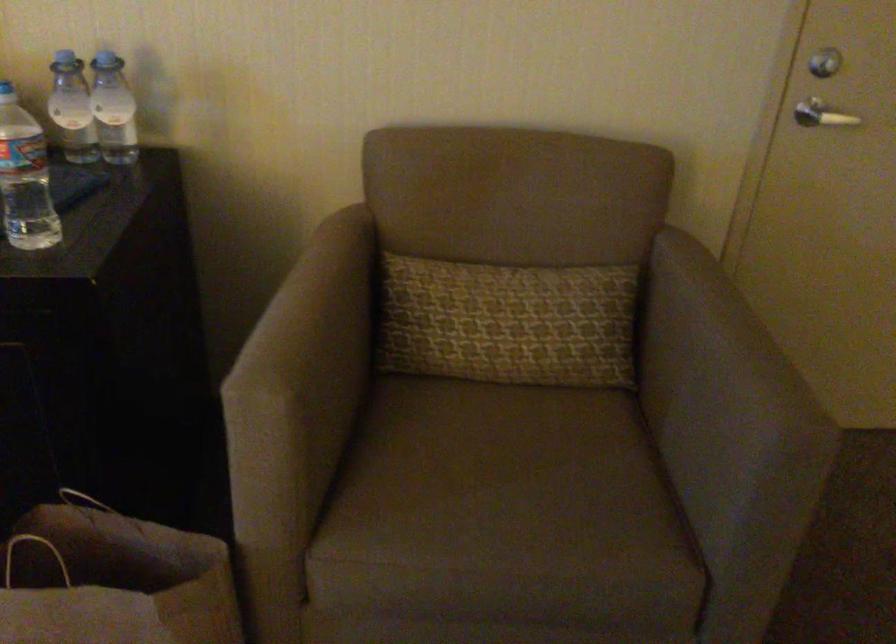
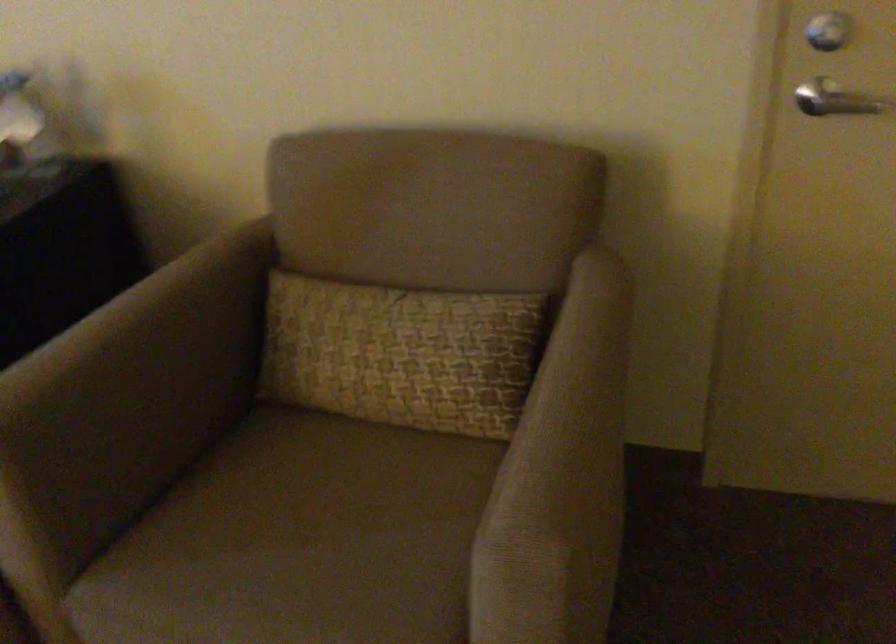
In the second image, find the point that corresponds to point 339,357 in the first image.

(135, 389)